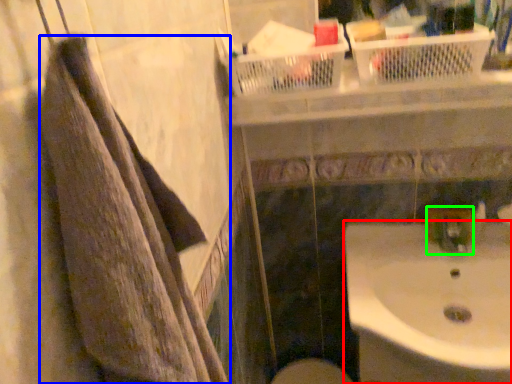
Question: Estimate the real-world distances between objects in this image. Which object is farther from sink (highlighted by a red box), towel (highlighted by a blue box) or plumbing fixture (highlighted by a green box)?

Choices:
 (A) towel
 (B) plumbing fixture

Answer: (A)